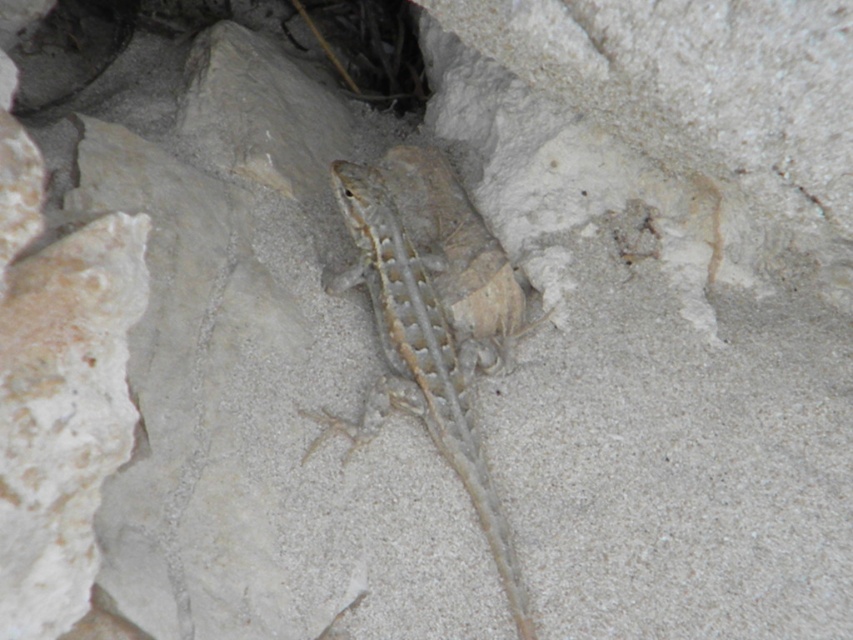
Which is above, desert gray scaly lizard at center or smooth stone hole at upper left?

Positioned higher is smooth stone hole at upper left.

Does desert gray scaly lizard at center lie behind smooth stone hole at upper left?

No, desert gray scaly lizard at center is closer to the viewer.

The image size is (853, 640). What are the coordinates of `desert gray scaly lizard at center` in the screenshot? It's located at (425, 353).